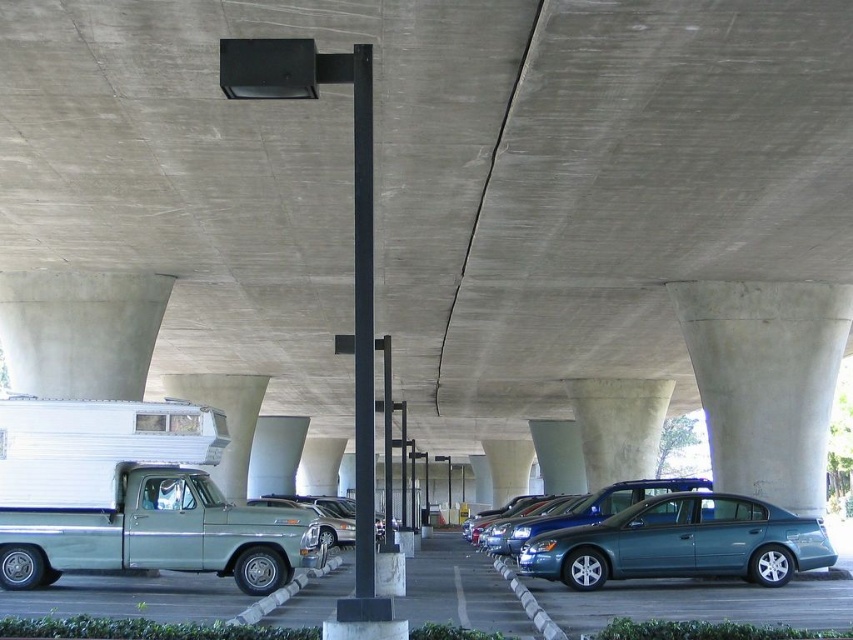
You are a delivery driver who needs to park your truck in this parking area. You see a teal metallic sedan at center and a metallic blue sedan at center. Which vehicle should you avoid parking next to if you need more space around your truck?

You should avoid parking next to the teal metallic sedan at center because it is thinner than the metallic blue sedan at center, meaning there will be more space available around the metallic blue sedan at center for your truck.

You are a delivery driver who needs to exit the parking area. You see a teal metallic sedan at center and a metallic blue sedan at center blocking your path. Which vehicle should you move first to clear the path?

The teal metallic sedan at center is in front of the metallic blue sedan at center, so you should move the teal metallic sedan at center first to clear the path.

You are standing at the entrance of the parking area and want to locate the teal metallic sedan at center. According to the coordinate system where the bottom left corner is the origin, which direction should you look to find it?

The teal metallic sedan at center is located at coordinate point 0.848 on the x axis and 0.801 on the y axis. Since the coordinate system has the bottom left corner as the origin, the x axis increases to the right and the y axis increases upward. Therefore, the teal metallic sedan at center is positioned to the upper right direction from the entrance.